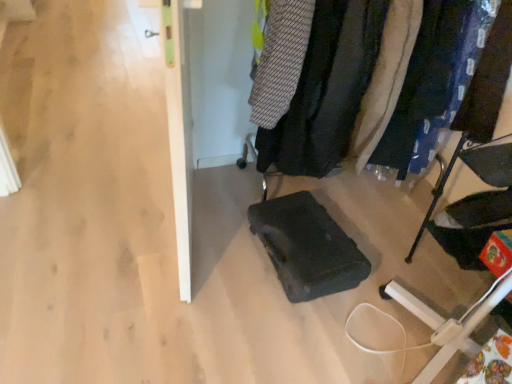
Question: Looking at the image, does blue fabric pants at right, which appears as the fourth clothing when viewed from the left, seem bigger or smaller compared to black fabric chair at lower right?

Choices:
 (A) big
 (B) small

Answer: (B)

Question: From a real-world perspective, is blue fabric pants at right, which appears as the fourth clothing when viewed from the left, positioned above or below black fabric chair at lower right?

Choices:
 (A) above
 (B) below

Answer: (A)

Question: Which is farther from the white textured fabric at center right, marked as the 2th clothing in a right-to-left arrangement?

Choices:
 (A) velvet black coat at center
 (B) knitted fabric sweater at upper center, which ranks as the 4th clothing in right-to-left order
 (C) knitted fabric sweater at upper right, the second clothing viewed from the left
 (D) blue fabric pants at right, which is the first clothing in right-to-left order
 (E) black fabric chair at lower right

Answer: (E)

Question: Which of these objects is positioned closest to the velvet black coat at center?

Choices:
 (A) knitted fabric sweater at upper center, which ranks as the 4th clothing in right-to-left order
 (B) black fabric chair at lower right
 (C) knitted fabric sweater at upper right, the second clothing viewed from the left
 (D) white textured fabric at center right, marked as the 2th clothing in a right-to-left arrangement
 (E) blue fabric pants at right, which appears as the fourth clothing when viewed from the left

Answer: (C)